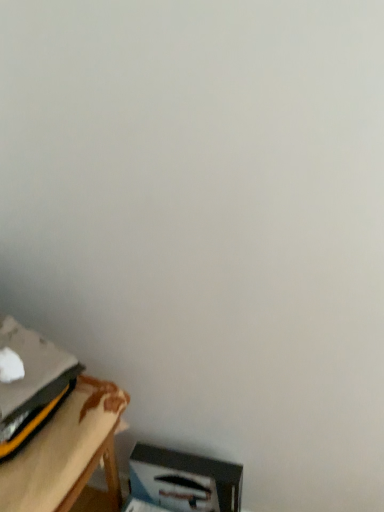
Question: Does wooden table at lower left have a lesser width compared to white cardboard box at lower right?

Choices:
 (A) yes
 (B) no

Answer: (B)

Question: Is wooden table at lower left at the right side of white cardboard box at lower right?

Choices:
 (A) yes
 (B) no

Answer: (B)

Question: From a real-world perspective, is wooden table at lower left on top of white cardboard box at lower right?

Choices:
 (A) no
 (B) yes

Answer: (B)

Question: Considering the relative sizes of wooden table at lower left and white cardboard box at lower right in the image provided, is wooden table at lower left shorter than white cardboard box at lower right?

Choices:
 (A) no
 (B) yes

Answer: (B)

Question: Is wooden table at lower left at the left side of white cardboard box at lower right?

Choices:
 (A) no
 (B) yes

Answer: (B)

Question: Is white cardboard box at lower right a part of wooden table at lower left?

Choices:
 (A) yes
 (B) no

Answer: (B)

Question: Can you confirm if white cardboard box at lower right is wider than wooden table at lower left?

Choices:
 (A) no
 (B) yes

Answer: (A)

Question: From the image's perspective, is white cardboard box at lower right located above wooden table at lower left?

Choices:
 (A) yes
 (B) no

Answer: (B)

Question: Is white cardboard box at lower right directly adjacent to wooden table at lower left?

Choices:
 (A) no
 (B) yes

Answer: (A)

Question: Is wooden table at lower left a part of white cardboard box at lower right?

Choices:
 (A) no
 (B) yes

Answer: (A)

Question: Is white cardboard box at lower right bigger than wooden table at lower left?

Choices:
 (A) no
 (B) yes

Answer: (A)

Question: Is white cardboard box at lower right to the right of wooden table at lower left from the viewer's perspective?

Choices:
 (A) no
 (B) yes

Answer: (B)

Question: Is wooden table at lower left bigger or smaller than white cardboard box at lower right?

Choices:
 (A) big
 (B) small

Answer: (A)